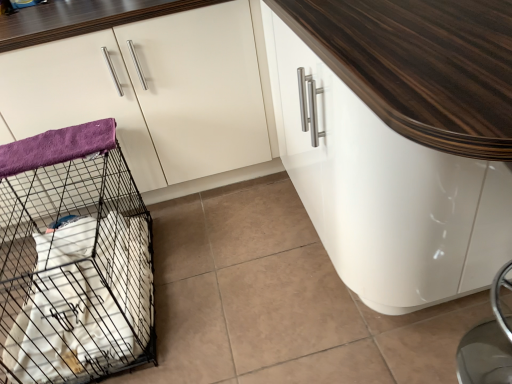
Question: Is purple fleece blanket at left to the left or to the right of white glossy cabinet at center, the 2th cabinetry viewed from the left, in the image?

Choices:
 (A) left
 (B) right

Answer: (A)

Question: From a real-world perspective, is purple fleece blanket at left above or below white glossy cabinet at center, which is counted as the first cabinetry, starting from the right?

Choices:
 (A) below
 (B) above

Answer: (B)

Question: Which of these objects is positioned farthest from the white glossy cabinet at upper left, positioned as the 1th cabinetry in left-to-right order?

Choices:
 (A) white glossy cabinet at center, which is counted as the first cabinetry, starting from the right
 (B) purple fleece blanket at left
 (C) black wire mesh cage at left

Answer: (A)

Question: Which is farther from the purple fleece blanket at left?

Choices:
 (A) white glossy cabinet at center, which is counted as the first cabinetry, starting from the right
 (B) white glossy cabinet at upper left, arranged as the 2th cabinetry when viewed from the right
 (C) black wire mesh cage at left

Answer: (A)